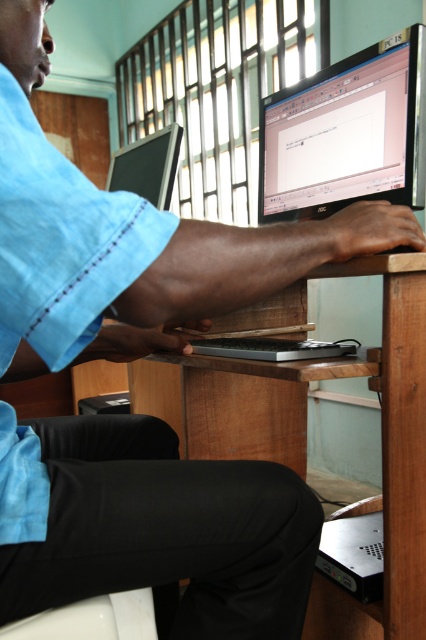
Question: Among these points, which one is nearest to the camera?

Choices:
 (A) (382, 516)
 (B) (294, 340)
 (C) (383, 92)

Answer: (B)

Question: Which is nearer to the wooden at center?

Choices:
 (A) satin black computer at lower right
 (B) matte black monitor at center

Answer: (A)

Question: Considering the relative positions of wooden at center and matte black monitor at center in the image provided, where is wooden at center located with respect to matte black monitor at center?

Choices:
 (A) left
 (B) right

Answer: (B)

Question: Is matte black monitor at center wider than silver metallic laptop at center?

Choices:
 (A) yes
 (B) no

Answer: (A)

Question: Can you confirm if satin black computer at lower right is positioned to the left of silver metallic laptop at center?

Choices:
 (A) no
 (B) yes

Answer: (A)

Question: Which point is farther to the camera?

Choices:
 (A) silver metallic laptop at center
 (B) matte black monitor at upper center
 (C) matte black monitor at center
 (D) wooden at center

Answer: (C)